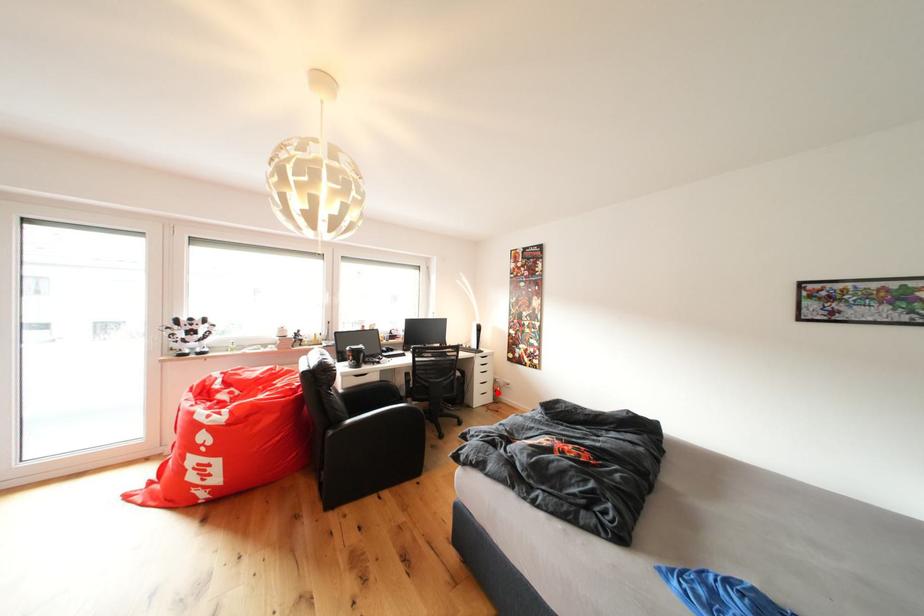
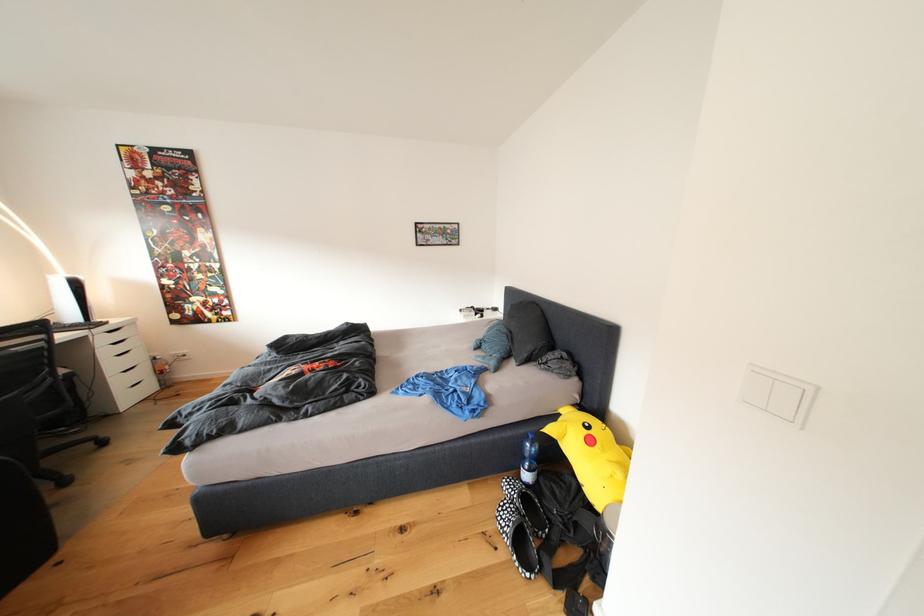
Question: I am providing you with two images of the same scene from different viewpoints. Image1 has a red point marked. In image2, the corresponding 3D location appears at what relative position? Reply with the corresponding letter.

Choices:
 (A) Closer
 (B) Farther

Answer: (A)